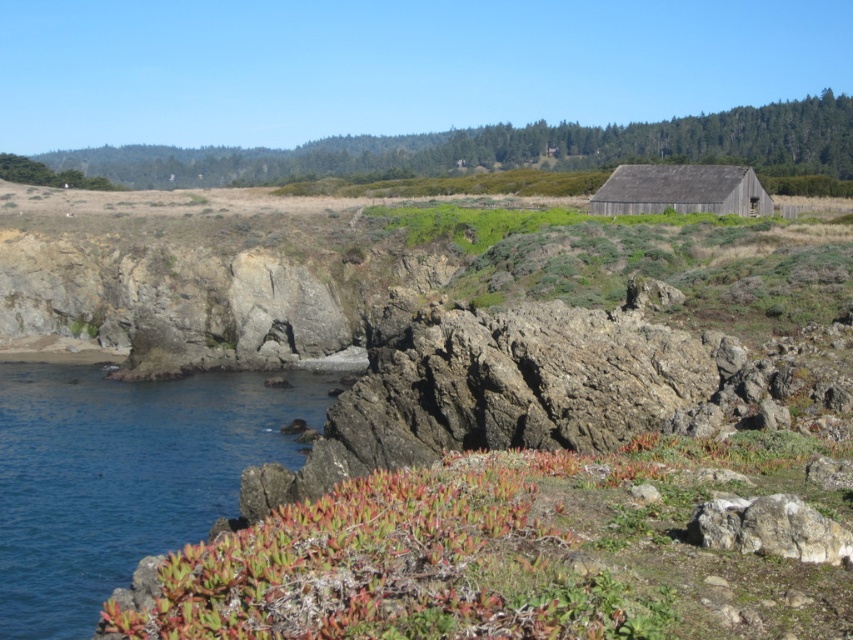
Question: Which point appears closest to the camera in this image?

Choices:
 (A) (247, 538)
 (B) (589, 128)
 (C) (726, 529)
 (D) (654, 193)

Answer: (A)

Question: In this image, where is green grassy field at center located relative to weathered wood barn at upper right?

Choices:
 (A) above
 (B) below

Answer: (A)

Question: Which point appears closest to the camera in this image?

Choices:
 (A) (660, 134)
 (B) (738, 545)

Answer: (B)

Question: Does green succulent at lower center appear over weathered wood barn at upper right?

Choices:
 (A) yes
 (B) no

Answer: (B)

Question: Is green succulent at lower center thinner than weathered wood barn at upper right?

Choices:
 (A) no
 (B) yes

Answer: (B)

Question: Which object is the closest to the green grassy field at center?

Choices:
 (A) green succulent at lower center
 (B) gray rough rock at lower right
 (C) weathered wood barn at upper right
 (D) blue water at lower left

Answer: (C)